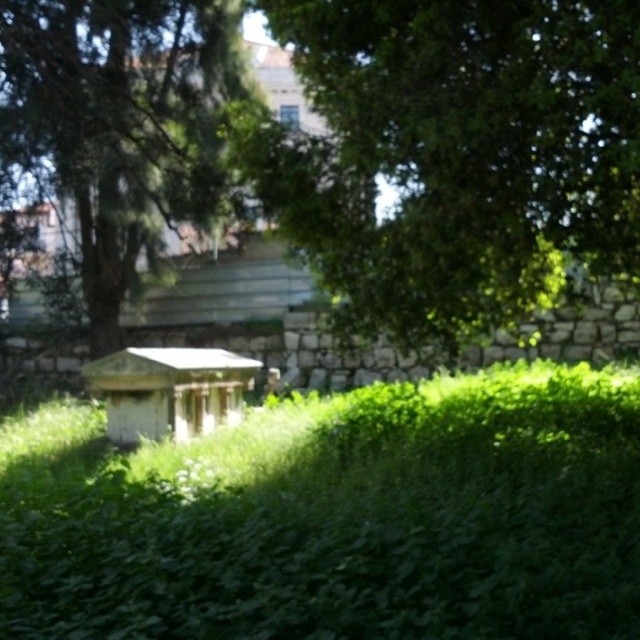
Question: Which point is farther from the camera taking this photo?

Choices:
 (A) (352, 433)
 (B) (54, 12)
 (C) (140, 403)
 (D) (332, 88)

Answer: (B)

Question: Which of the following is the farthest from the observer?

Choices:
 (A) green leafy grass at center
 (B) green leafy tree at upper center
 (C) green leafy tree at center

Answer: (C)

Question: Does green leafy tree at upper center have a lesser width compared to green leafy tree at center?

Choices:
 (A) yes
 (B) no

Answer: (A)

Question: Which point is closer to the camera taking this photo?

Choices:
 (A) (349, 396)
 (B) (304, 13)
 (C) (179, 371)

Answer: (B)

Question: Does green leafy tree at center appear on the right side of white wood gazebo at center?

Choices:
 (A) no
 (B) yes

Answer: (A)

Question: Observing the image, what is the correct spatial positioning of green leafy tree at upper center in reference to white wood gazebo at center?

Choices:
 (A) above
 (B) below

Answer: (A)